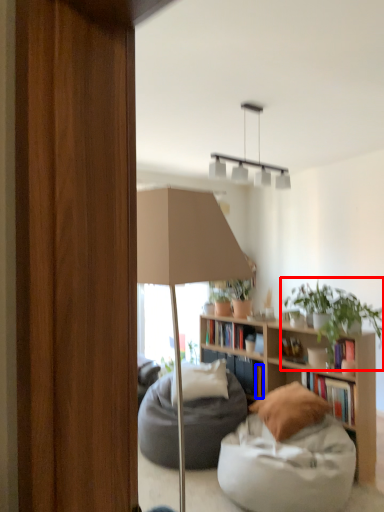
Question: Among these objects, which one is nearest to the camera, houseplant (highlighted by a red box) or book (highlighted by a blue box)?

Choices:
 (A) houseplant
 (B) book

Answer: (A)